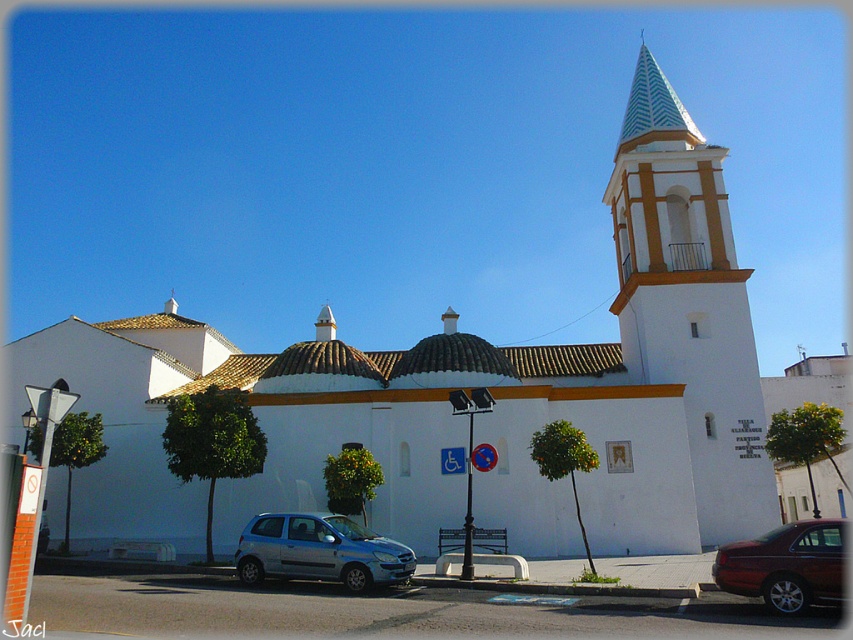
Question: Which is farther from the shiny dark red sedan at lower right?

Choices:
 (A) white painted stucco bell tower at upper right
 (B) satin silver hatchback at lower center

Answer: (A)

Question: Which point is closer to the camera?

Choices:
 (A) (380, 545)
 (B) (645, 157)

Answer: (A)

Question: Which point is closer to the camera?

Choices:
 (A) 238,547
 (B) 717,477

Answer: (A)

Question: Is satin silver hatchback at lower center smaller than shiny dark red sedan at lower right?

Choices:
 (A) no
 (B) yes

Answer: (A)

Question: Does white painted stucco bell tower at upper right have a smaller size compared to satin silver hatchback at lower center?

Choices:
 (A) yes
 (B) no

Answer: (B)

Question: In this image, where is satin silver hatchback at lower center located relative to shiny dark red sedan at lower right?

Choices:
 (A) above
 (B) below

Answer: (B)